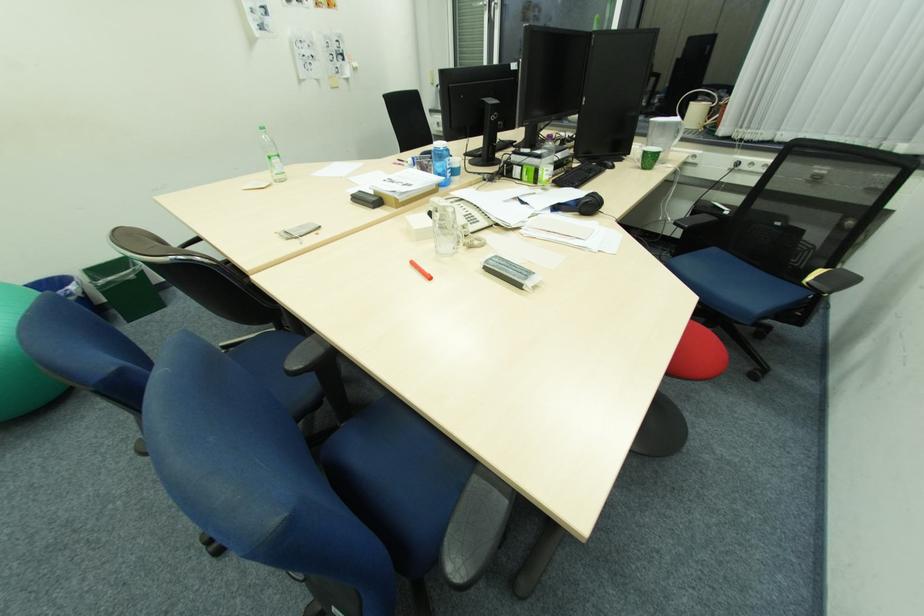
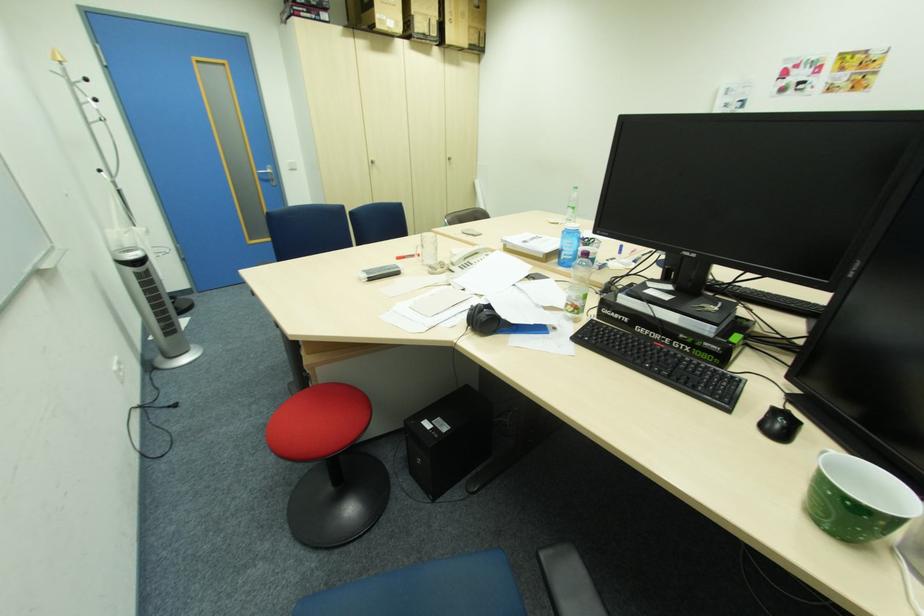
Question: I am providing you with two images of the same scene from different viewpoints. Which of the following objects are not visible in image2?

Choices:
 (A) blue trash can
 (B) white telephone buttons
 (C) silver cabinet handle
 (D) coat rack hook

Answer: (A)